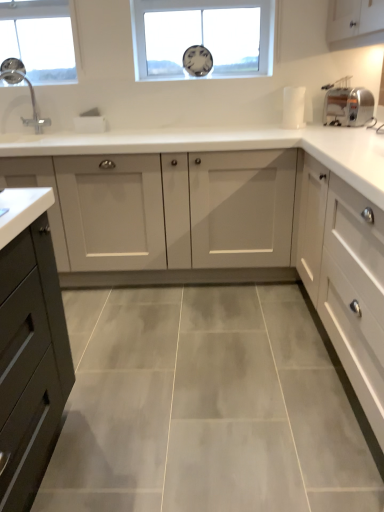
Question: In the image, is transparent glass clock at upper center, which is counted as the 1th window, starting from the right, positioned in front of or behind white matte cabinet at right, the first cabinetry positioned from the front?

Choices:
 (A) front
 (B) behind

Answer: (B)

Question: Choose the correct answer: Is transparent glass clock at upper center, which is counted as the 1th window, starting from the right, inside white matte cabinet at right, the first cabinetry positioned from the front, or outside it?

Choices:
 (A) outside
 (B) inside

Answer: (A)

Question: Estimate the real-world distances between objects in this image. Which object is closer to the transparent glass clock at upper center, which is the second window from left to right?

Choices:
 (A) white matte cabinet at right, the first cabinetry positioned from the front
 (B) white glossy cabinet at center, which ranks as the first cabinetry in back-to-front order
 (C) clear glass window at upper left, the 2th window positioned from the right
 (D) satin silver toaster at right
 (E) matte silver faucet at left

Answer: (D)

Question: Estimate the real-world distances between objects in this image. Which object is closer to the transparent glass clock at upper center, which is counted as the 1th window, starting from the right?

Choices:
 (A) white glossy cabinet at center, which ranks as the first cabinetry in back-to-front order
 (B) clear glass window at upper left, which ranks as the first window in left-to-right order
 (C) matte silver faucet at left
 (D) satin silver toaster at right
 (E) white matte cabinet at right, the second cabinetry positioned from the back

Answer: (D)